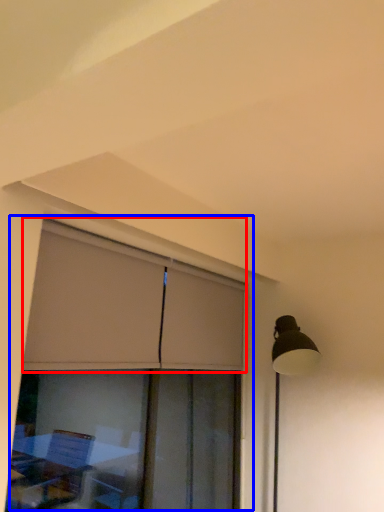
Question: Which point is further to the camera, curtain (highlighted by a red box) or window (highlighted by a blue box)?

Choices:
 (A) curtain
 (B) window

Answer: (A)